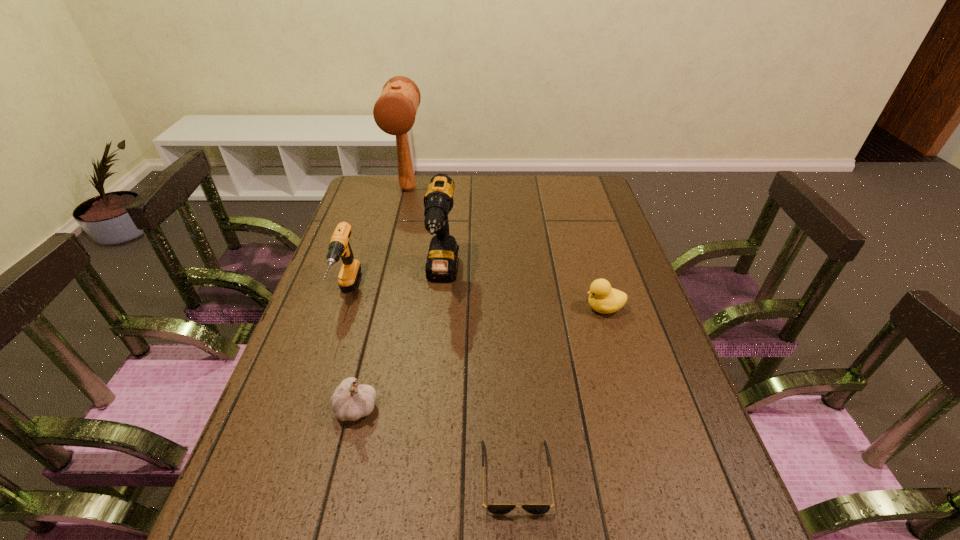
I want to click on empty space that is in between the third tallest object and the fifth tallest object, so click(x=475, y=301).

The image size is (960, 540). I want to click on vacant region between the second shortest object and the sunglasses, so click(560, 392).

This screenshot has height=540, width=960. What are the coordinates of `free space between the third tallest object and the duck` in the screenshot? It's located at (475, 301).

You are a GUI agent. You are given a task and a screenshot of the screen. Output one action in this format:
    pyautogui.click(x=<x>, y=<y>)
    Task: Click on the vacant space that is in between the rightmost object and the third shortest object
    The height and width of the screenshot is (540, 960).
    Given the screenshot: What is the action you would take?
    pyautogui.click(x=480, y=358)

Locate an element on the screen. The height and width of the screenshot is (540, 960). blank region between the rightmost object and the taller drill is located at coordinates (523, 292).

The image size is (960, 540). Identify the location of free space between the duck and the leftmost object. (475, 301).

What are the coordinates of `unoccupied position between the nearest object and the garlic` in the screenshot? It's located at (436, 442).

Where is `vacant area that lies between the second object from right to left and the fifth tallest object`? Image resolution: width=960 pixels, height=540 pixels. vacant area that lies between the second object from right to left and the fifth tallest object is located at coordinates (560, 392).

Image resolution: width=960 pixels, height=540 pixels. Find the location of `free space between the third tallest object and the garlic`. free space between the third tallest object and the garlic is located at coordinates (351, 351).

Where is `free space between the shorter drill and the garlic`? The image size is (960, 540). free space between the shorter drill and the garlic is located at coordinates (351, 351).